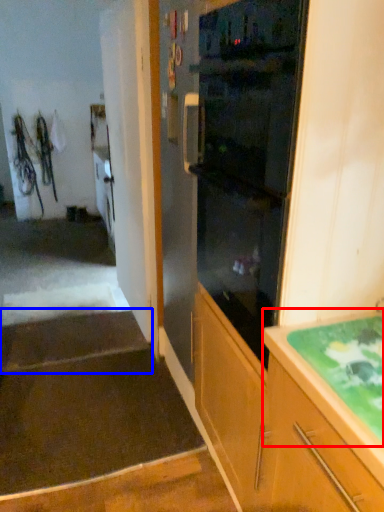
Question: Among these objects, which one is nearest to the camera, countertop (highlighted by a red box) or stairwell (highlighted by a blue box)?

Choices:
 (A) countertop
 (B) stairwell

Answer: (A)